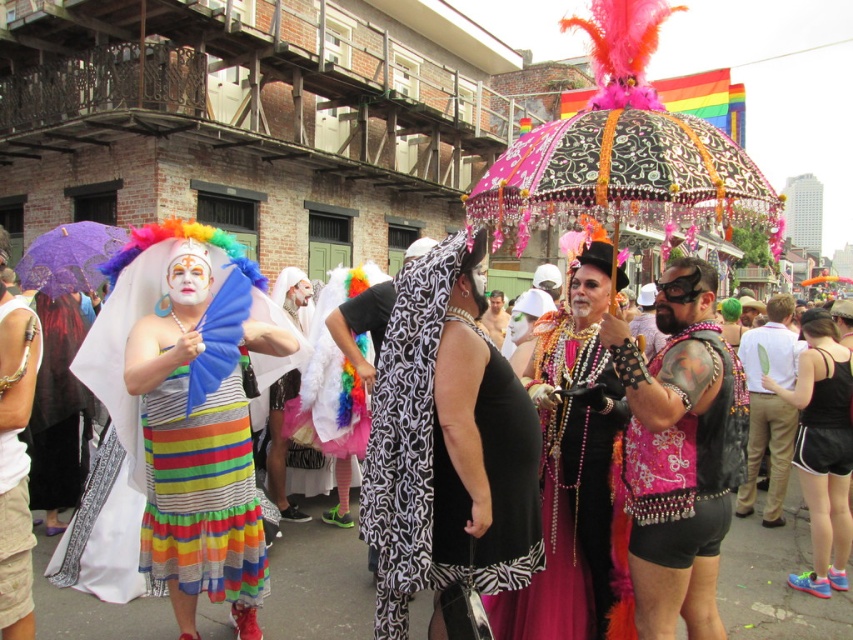
Question: Which of the following is the closest to the observer?

Choices:
 (A) shiny sequined dress at center
 (B) white lace veil at center
 (C) striped cotton dress at center
 (D) white matte tank top at left

Answer: (D)

Question: Estimate the real-world distances between objects in this image. Which object is closer to the pink sequined vest at center-right?

Choices:
 (A) shiny sequined dress at center
 (B) striped cotton dress at center

Answer: (A)

Question: Does black mesh tank top at lower right appear on the left side of white matte tank top at left?

Choices:
 (A) yes
 (B) no

Answer: (B)

Question: Does purple lace umbrella at upper left appear on the right side of white lace veil at center?

Choices:
 (A) no
 (B) yes

Answer: (A)

Question: Which point appears farthest from the camera in this image?

Choices:
 (A) (700, 417)
 (B) (64, 355)
 (C) (181, 541)
 (D) (273, 442)

Answer: (D)

Question: Can you confirm if black mesh tank top at lower right is bigger than matte black dress at left?

Choices:
 (A) yes
 (B) no

Answer: (B)